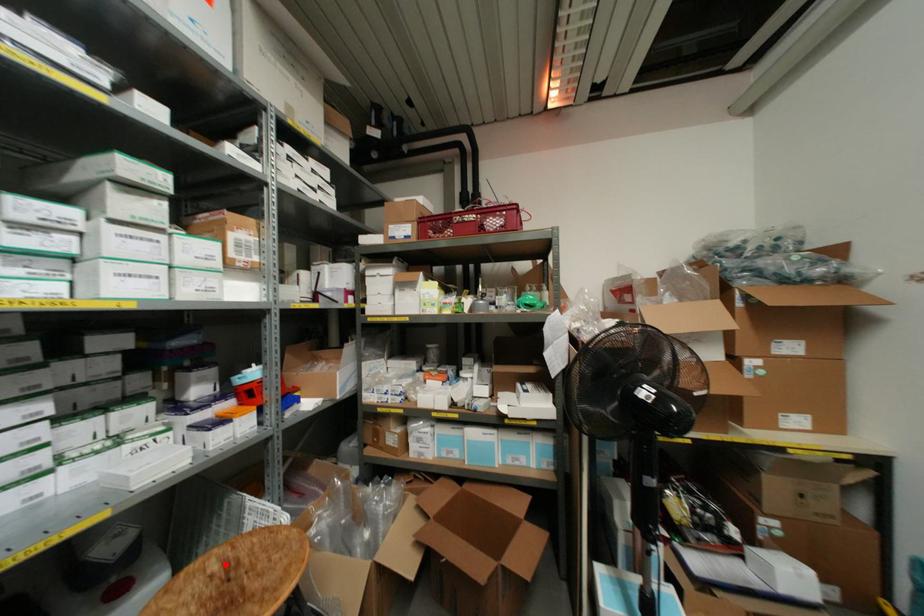
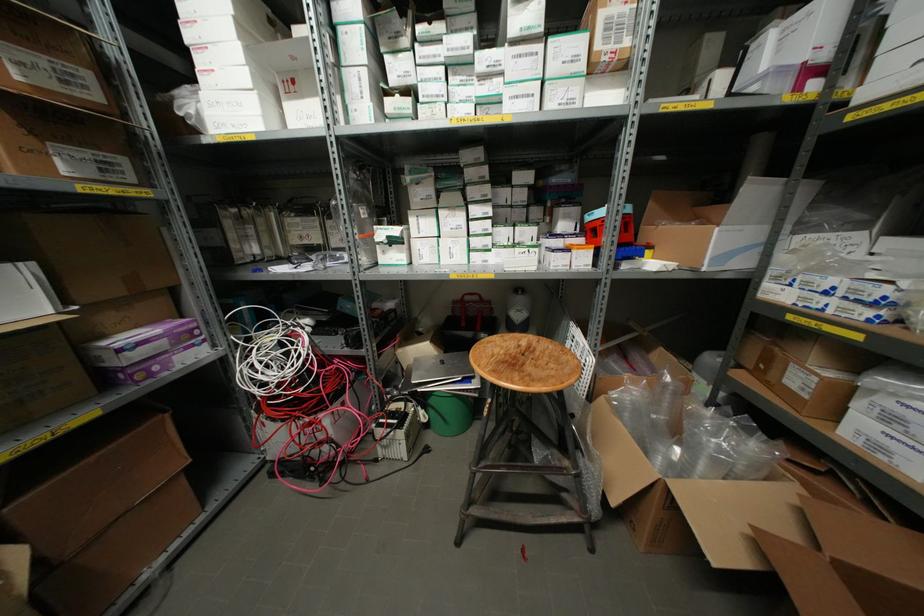
Locate, in the second image, the point that corresponds to the highlighted location in the first image.

(529, 347)